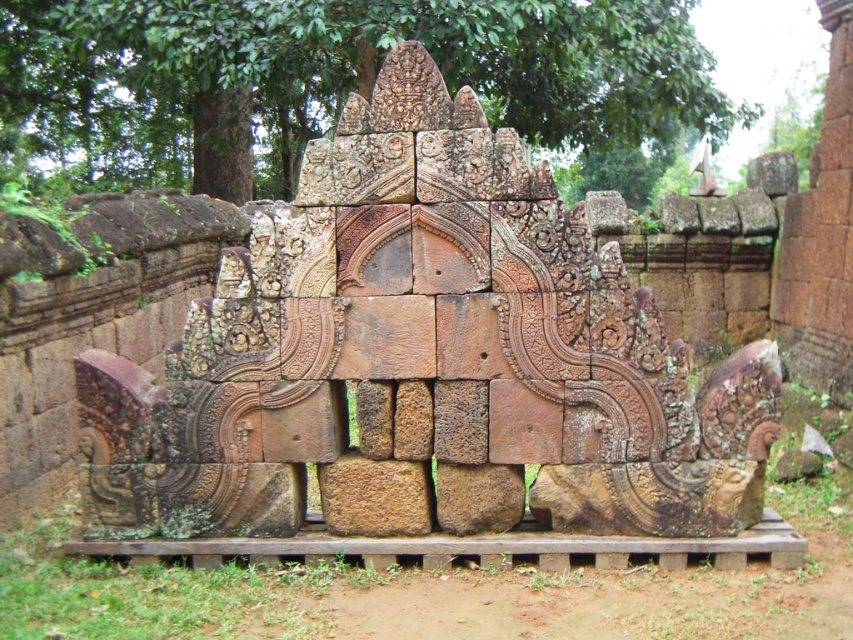
You are an archaeologist examining the ancient stone structure. You need to determine the spatial relationship between the rustic stone sculpture at center and the green leafy tree at upper center. Which object is wider?

The rustic stone sculpture at center is wider than the green leafy tree at upper center.

You are standing in front of the stone structure and want to take a photo of the rustic stone sculpture at center. Where should you position yourself to capture it in the frame?

The rustic stone sculpture at center is located at point (422, 358), so you should position yourself directly in front of it to capture it in the frame.

You are an archaeologist examining the ancient stone structure. You notice the rustic stone sculpture at center and the green leafy tree at upper center. Which object is located above the other?

The green leafy tree at upper center is located above the rustic stone sculpture at center because the sculpture is positioned under the tree.